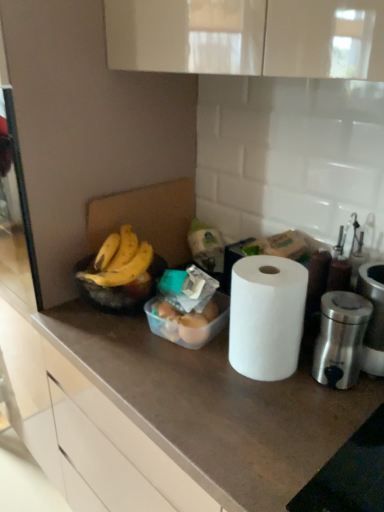
What are the coordinates of `vacant area situated to the left side of polished stainless steel appliance at right` in the screenshot? It's located at (251, 396).